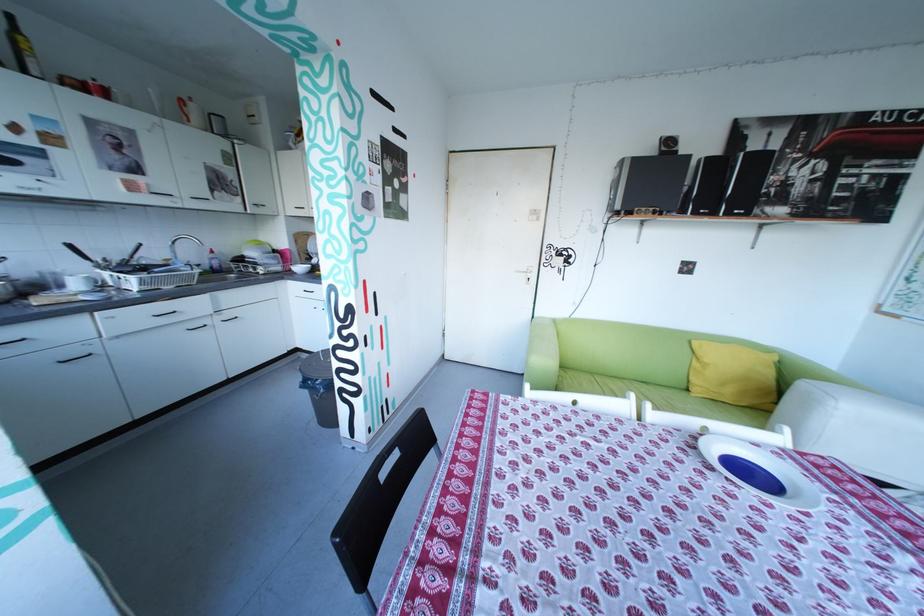
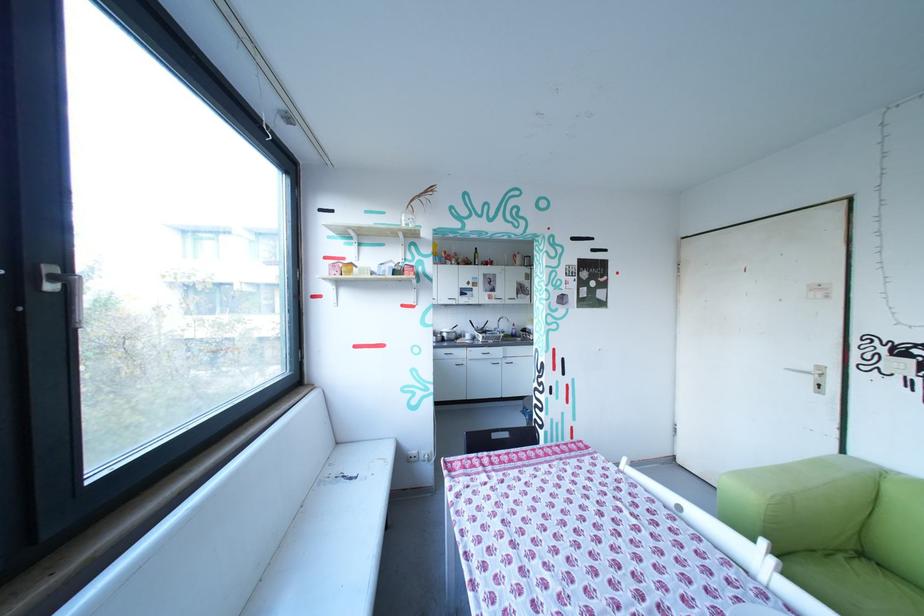
Question: The first image is from the beginning of the video and the second image is from the end. How did the camera likely rotate when shooting the video?

Choices:
 (A) Left
 (B) Right
 (C) Up
 (D) Down

Answer: (A)